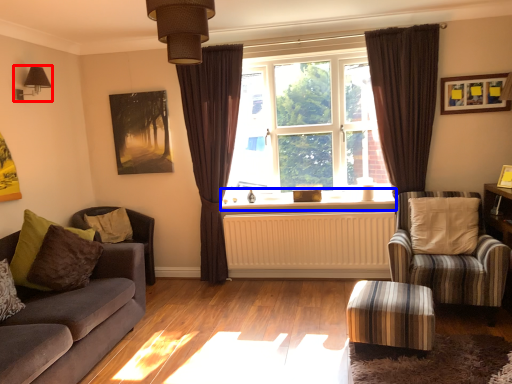
Question: Which point is further to the camera, light fixture (highlighted by a red box) or window sill (highlighted by a blue box)?

Choices:
 (A) light fixture
 (B) window sill

Answer: (B)